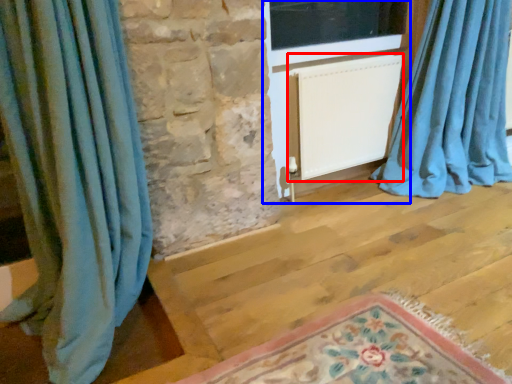
Question: Which point is further to the camera, radiator (highlighted by a red box) or screen door (highlighted by a blue box)?

Choices:
 (A) radiator
 (B) screen door

Answer: (A)